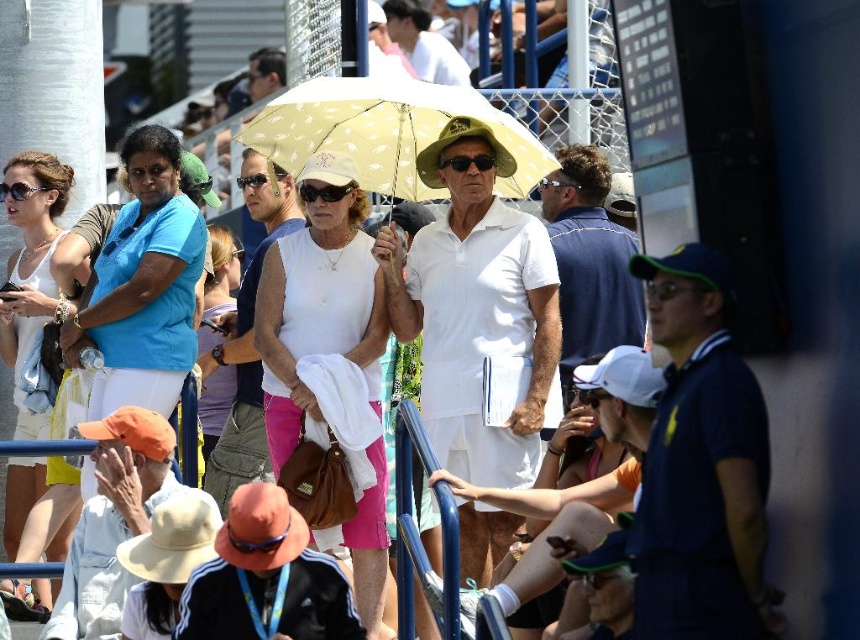
Can you confirm if matte black sunglasses at center is wider than black plastic sunglasses at center?

Incorrect, matte black sunglasses at center's width does not surpass black plastic sunglasses at center's.

Image resolution: width=860 pixels, height=640 pixels. I want to click on matte black sunglasses at center, so click(x=323, y=192).

Find the location of a particular element. This screenshot has width=860, height=640. matte black sunglasses at center is located at coordinates (323, 192).

Looking at this image, is white matte tank top at center positioned behind white fabric shirt at center?

No, white matte tank top at center is in front of white fabric shirt at center.

Which is behind, point (280, 353) or point (203, 384)?

Positioned behind is point (203, 384).

Locate an element on the screen. white matte tank top at center is located at coordinates (277, 332).

How much distance is there between white matte tank top at center and matte black sunglasses at center?

white matte tank top at center is 24.88 feet away from matte black sunglasses at center.

Image resolution: width=860 pixels, height=640 pixels. Identify the location of white matte tank top at center. (277, 332).

Find the location of `white matte tank top at center`. white matte tank top at center is located at coordinates (277, 332).

The height and width of the screenshot is (640, 860). In order to click on white matte tank top at center in this screenshot , I will do `click(277, 332)`.